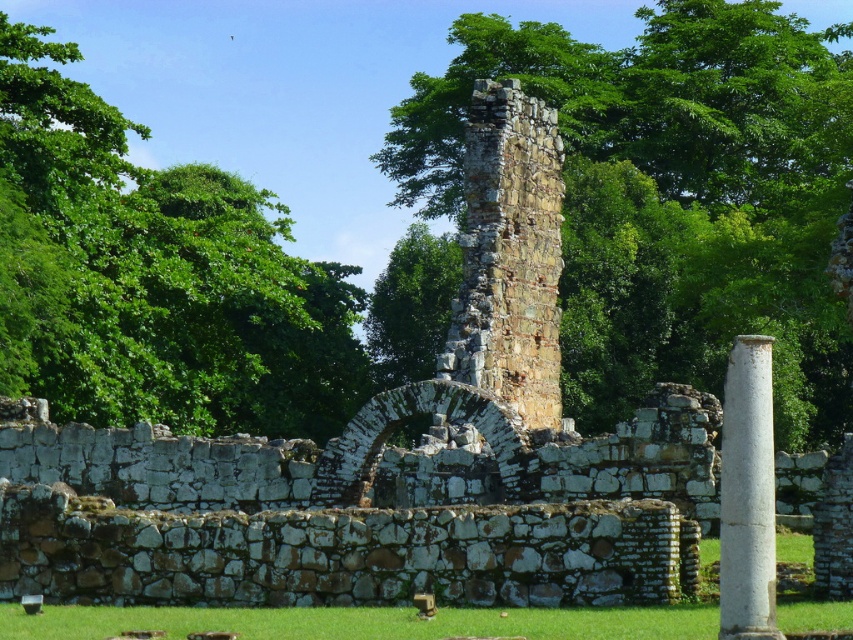
Question: Does green leafy tree at left appear under green grass at lower center?

Choices:
 (A) yes
 (B) no

Answer: (B)

Question: Which object is farther from the camera taking this photo?

Choices:
 (A) white stone column at right
 (B) green grass at lower center
 (C) green leafy tree at left

Answer: (C)

Question: Is green leafy tree at left thinner than green grass at lower center?

Choices:
 (A) yes
 (B) no

Answer: (B)

Question: Estimate the real-world distances between objects in this image. Which object is closer to the green leafy tree at left?

Choices:
 (A) green leafy tree at center
 (B) green grass at lower center
 (C) white stone column at right

Answer: (A)

Question: Which object is closer to the camera taking this photo?

Choices:
 (A) green grass at lower center
 (B) white stone column at right
 (C) green leafy tree at center

Answer: (B)

Question: Is green leafy tree at center to the left of green leafy tree at left from the viewer's perspective?

Choices:
 (A) yes
 (B) no

Answer: (B)